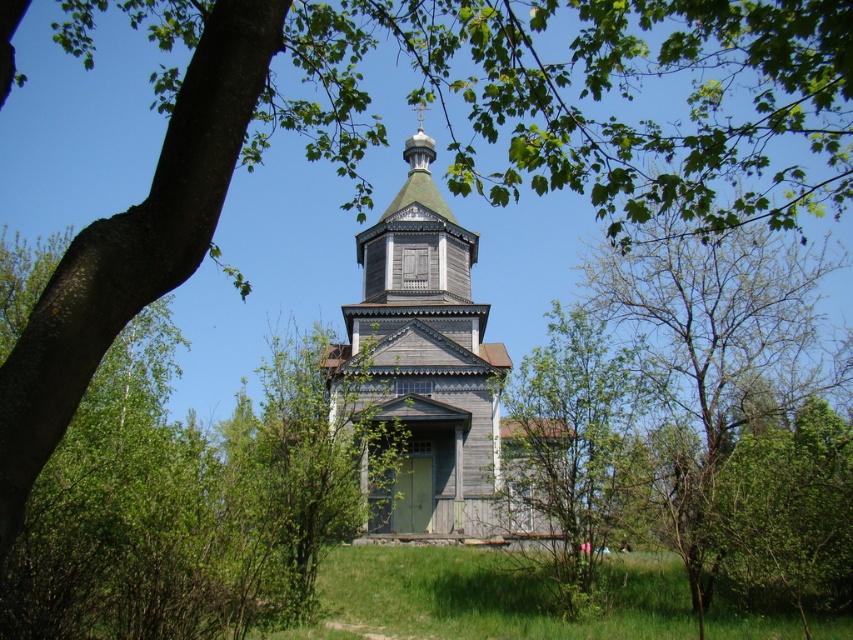
Based on the provided scene description, where is the wooden church at center located in terms of coordinates?

The wooden church at center is located at coordinates point (428, 364).

You are standing in front of the church and notice two points marked on the image. The first point is at coordinate point (x=405, y=412) and the second is at point (x=560, y=410). Which point is closer to your eyes?

Point (x=405, y=412) is further to the camera than point (x=560, y=410), so the point closer to your eyes is point (x=560, y=410).